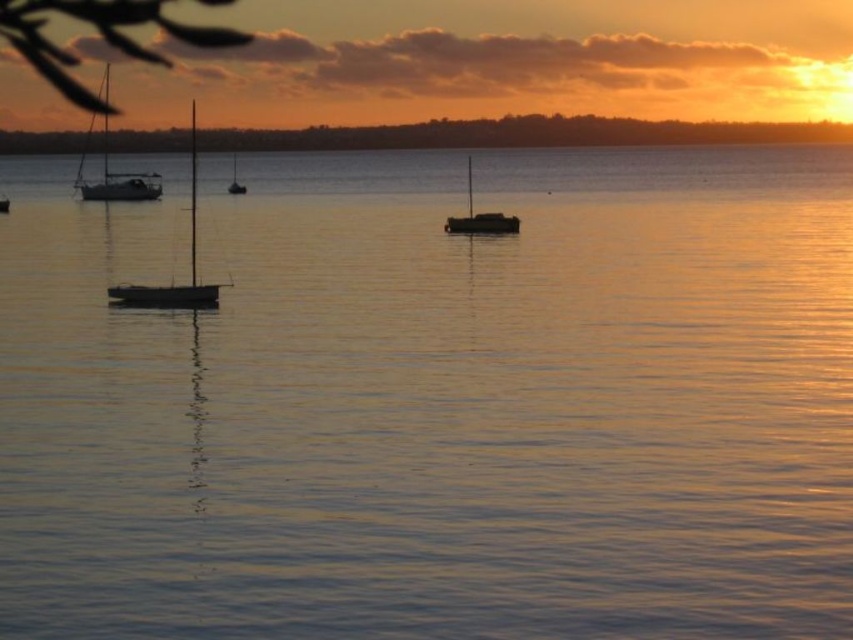
Question: Can you confirm if orange matte horizon at upper center is smaller than white matte sailboat at left?

Choices:
 (A) no
 (B) yes

Answer: (B)

Question: Is silvery metallic sailboat at left thinner than dark brown wooden boat at center?

Choices:
 (A) yes
 (B) no

Answer: (A)

Question: Among these objects, which one is farthest from the camera?

Choices:
 (A) silvery metallic sailboat at left
 (B) dark brown wooden boat at center
 (C) orange matte horizon at upper center

Answer: (C)

Question: Among these objects, which one is nearest to the camera?

Choices:
 (A) white matte sailboat at left
 (B) shiny silver sailboat at center
 (C) orange matte horizon at upper center
 (D) silvery metallic sailboat at left

Answer: (D)

Question: Where is white matte sailboat at left located in relation to dark brown wooden boat at center in the image?

Choices:
 (A) below
 (B) above

Answer: (B)

Question: Among these points, which one is nearest to the camera?

Choices:
 (A) (115, 182)
 (B) (39, 145)
 (C) (473, 227)

Answer: (C)